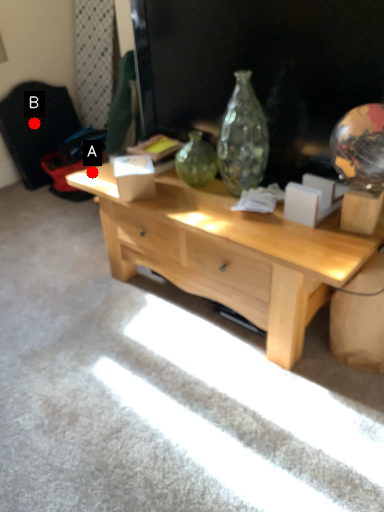
Question: Two points are circled on the image, labeled by A and B beside each circle. Which point is farther to the camera?

Choices:
 (A) A is further
 (B) B is further

Answer: (B)